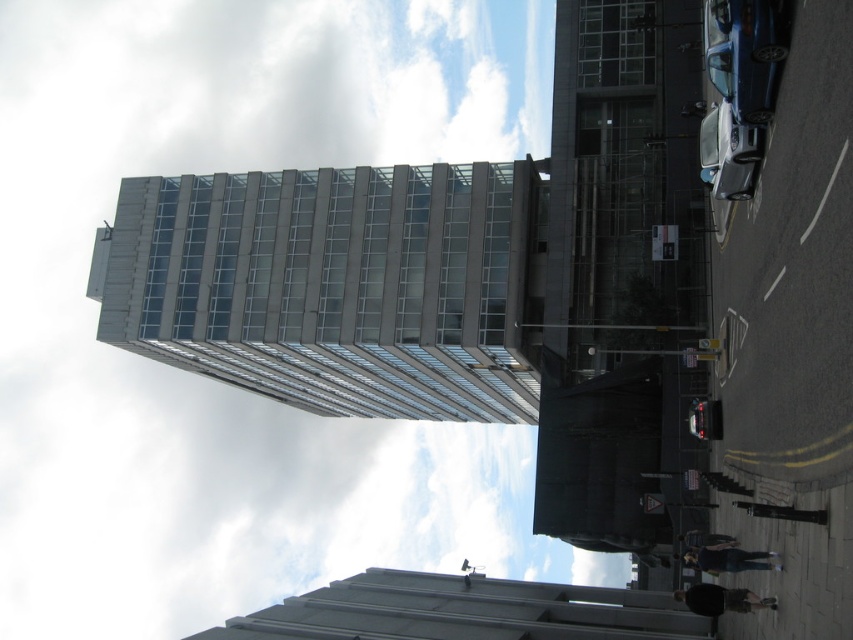
In the scene shown: Is glassy concrete tower at center positioned at the back of glassy concrete building at center?

Yes, glassy concrete tower at center is further from the viewer.

Can you confirm if glassy concrete tower at center is positioned to the right of glassy concrete building at center?

No, glassy concrete tower at center is not to the right of glassy concrete building at center.

Where is `glassy concrete tower at center`? glassy concrete tower at center is located at coordinates 334,285.

Looking at this image, who is higher up, white glass building at upper center or glassy concrete building at center?

Positioned higher is white glass building at upper center.

What do you see at coordinates (207, 380) in the screenshot? I see `white glass building at upper center` at bounding box center [207, 380].

Locate an element on the screen. This screenshot has width=853, height=640. white glass building at upper center is located at coordinates (207, 380).

Who is higher up, white glass building at upper center or glassy concrete tower at center?

white glass building at upper center

At what (x,y) coordinates should I click in order to perform the action: click on white glass building at upper center. Please return your answer as a coordinate pair (x, y). Looking at the image, I should click on (207, 380).

Who is more distant from viewer, [115,424] or [519,364]?

The point [115,424] is behind.

Identify the location of white glass building at upper center. This screenshot has width=853, height=640. (207, 380).